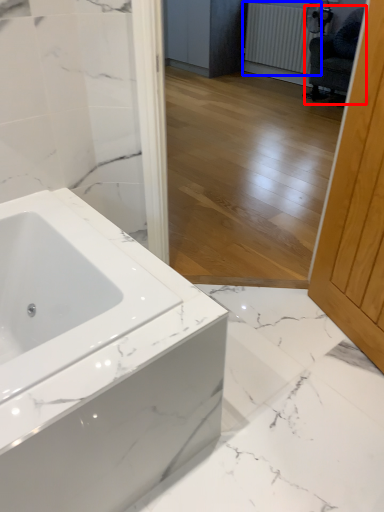
Question: Among these objects, which one is farthest to the camera, swivel chair (highlighted by a red box) or radiator (highlighted by a blue box)?

Choices:
 (A) swivel chair
 (B) radiator

Answer: (B)